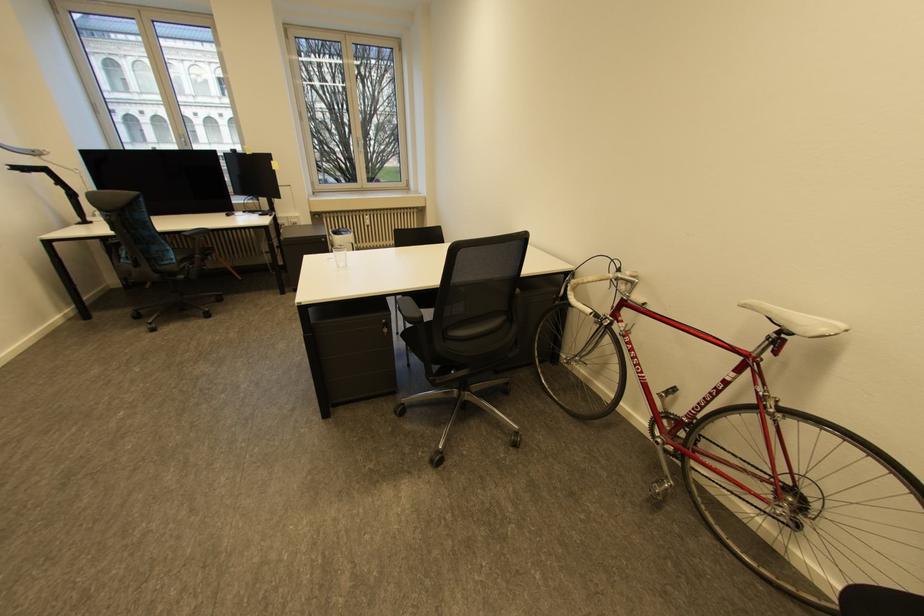
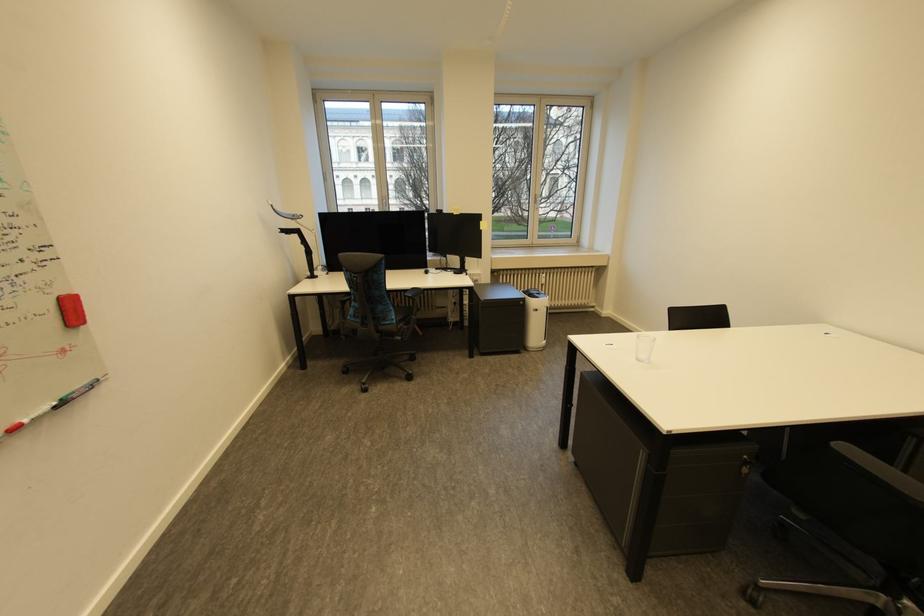
Question: What movement of the cameraman would produce the second image?

Choices:
 (A) Left
 (B) Right
 (C) Forward
 (D) Backward

Answer: (A)